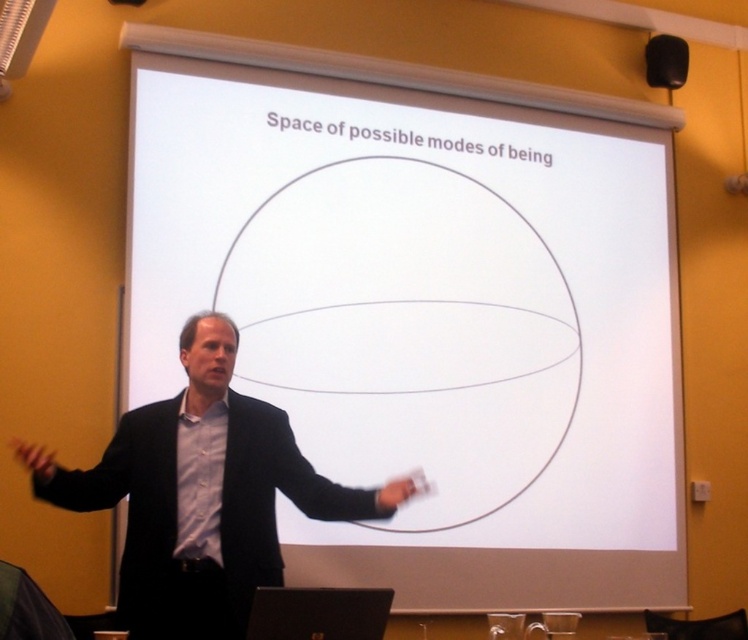
Can you confirm if white matte projection screen at center is positioned above black matte suit at left?

Indeed, white matte projection screen at center is positioned over black matte suit at left.

Which is in front, point (579, 257) or point (254, 458)?

Point (254, 458) is more forward.

Where is `white matte projection screen at center`? white matte projection screen at center is located at coordinates (429, 310).

Can you confirm if black matte suit at left is positioned below black matte speaker at upper right?

Indeed, black matte suit at left is positioned under black matte speaker at upper right.

Where is `black matte suit at left`? This screenshot has width=748, height=640. black matte suit at left is located at coordinates (202, 493).

Who is more distant from viewer, (165,461) or (654,49)?

The point (654,49) is more distant.

Where is `black matte suit at left`? The width and height of the screenshot is (748, 640). black matte suit at left is located at coordinates (202, 493).

Which is below, white matte projection screen at center or black matte speaker at upper right?

Positioned lower is white matte projection screen at center.

Does white matte projection screen at center have a larger size compared to black matte speaker at upper right?

Correct, white matte projection screen at center is larger in size than black matte speaker at upper right.

What do you see at coordinates (429, 310) in the screenshot?
I see `white matte projection screen at center` at bounding box center [429, 310].

Locate an element on the screen. The height and width of the screenshot is (640, 748). white matte projection screen at center is located at coordinates (429, 310).